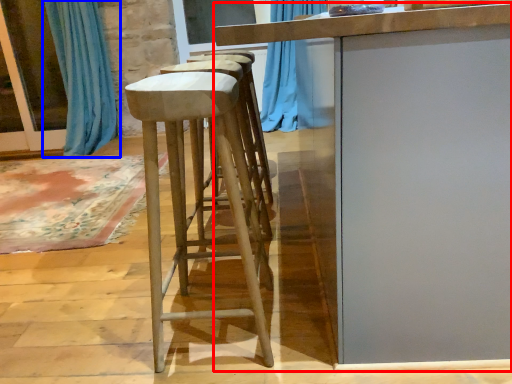
Question: Which object appears farthest to the camera in this image, table (highlighted by a red box) or curtain (highlighted by a blue box)?

Choices:
 (A) table
 (B) curtain

Answer: (B)